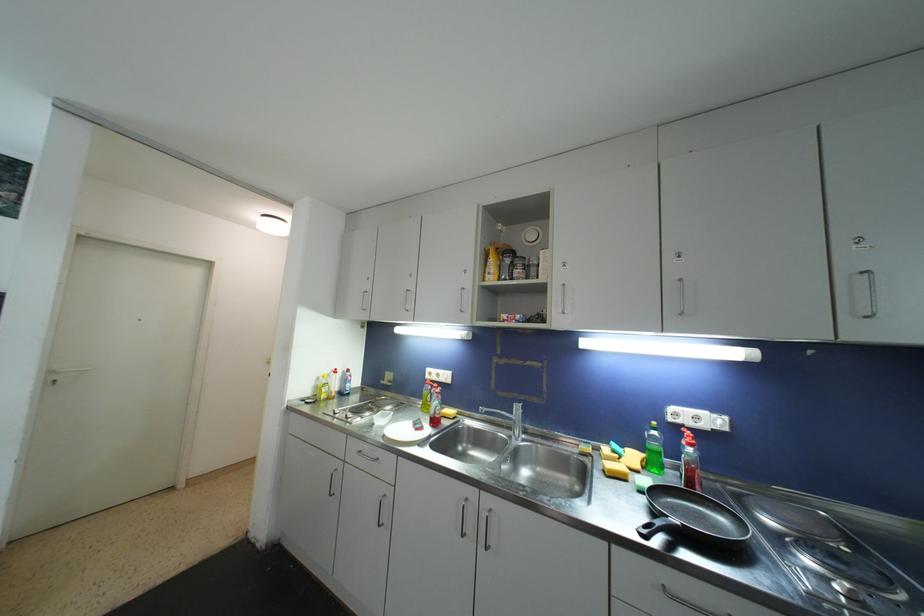
The width and height of the screenshot is (924, 616). Find the location of `black frying pan handle`. black frying pan handle is located at coordinates (652, 528).